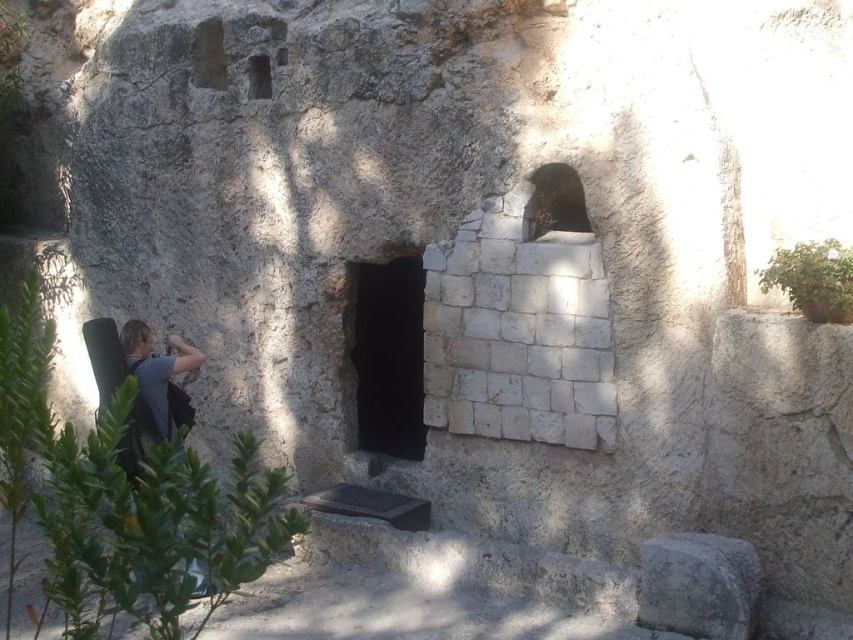
Does point (724, 621) lie in front of point (164, 404)?

That is True.

Is point (692, 604) positioned before point (172, 355)?

That is True.

Identify the location of gray rough stone at lower right. This screenshot has height=640, width=853. (698, 586).